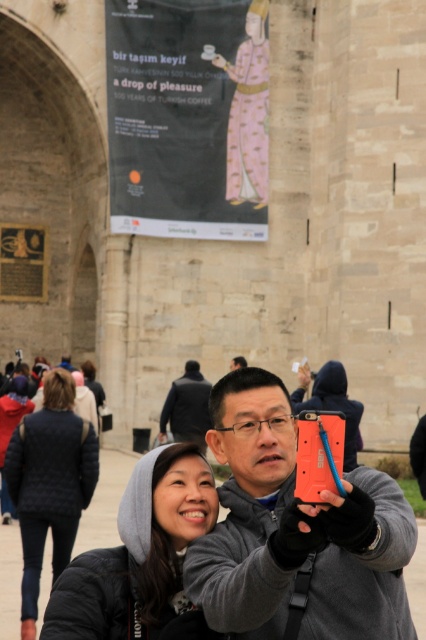
Question: Which object is closer to the camera taking this photo?

Choices:
 (A) matte black poster at upper center
 (B) gray hoodie at center
 (C) quilted black jacket at lower left

Answer: (B)

Question: Is orange matte phone at center positioned at the back of quilted black jacket at lower left?

Choices:
 (A) no
 (B) yes

Answer: (A)

Question: Which is nearer to the pink satin dress at upper center?

Choices:
 (A) quilted black jacket at lower left
 (B) gray hoodie at center
 (C) matte black poster at upper center

Answer: (C)

Question: Can you confirm if orange matte phone at center is positioned to the right of dark gray jacket at center?

Choices:
 (A) yes
 (B) no

Answer: (A)

Question: Does orange matte phone at center appear under pink satin dress at upper center?

Choices:
 (A) no
 (B) yes

Answer: (B)

Question: Which of these objects is positioned closest to the dark gray jacket at center?

Choices:
 (A) matte black poster at upper center
 (B) gray hoodie at center

Answer: (A)